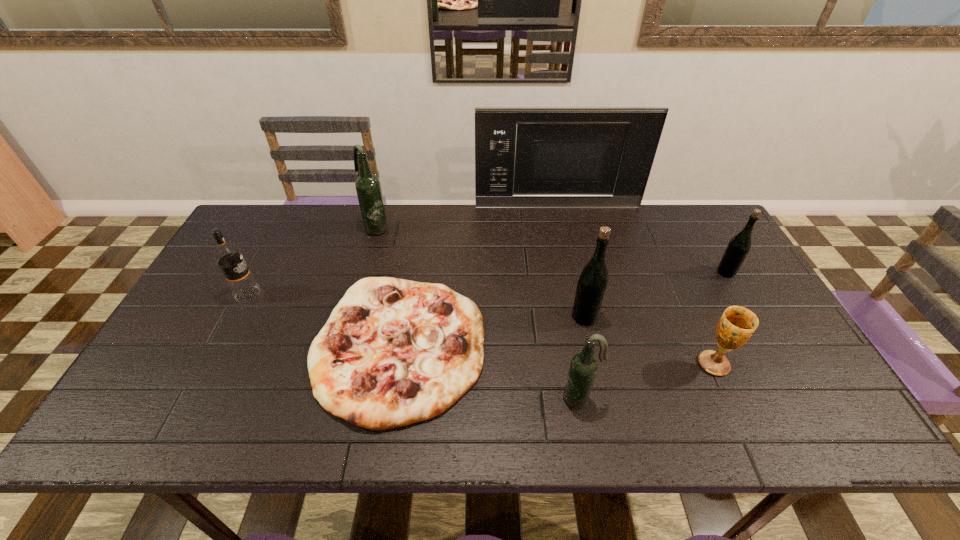
Where is `vacant space at the right edge`? This screenshot has height=540, width=960. vacant space at the right edge is located at coordinates (722, 309).

The image size is (960, 540). In the image, there is a desktop. Identify the location of vacant area at the far left corner. (276, 240).

Identify the location of vacant space at the far right corner of the desktop. (720, 237).

You are a GUI agent. You are given a task and a screenshot of the screen. Output one action in this format:
    pyautogui.click(x=<x>, y=<y>)
    Task: Click on the free space between the leftmost object and the shortest object
    The height and width of the screenshot is (540, 960).
    Given the screenshot: What is the action you would take?
    pyautogui.click(x=324, y=321)

This screenshot has height=540, width=960. In order to click on empty space between the shortest object and the nearer dark beer bottle in this screenshot , I will do `click(490, 373)`.

Find the location of a particular element. Image resolution: width=960 pixels, height=540 pixels. vacant region between the chalice and the second farthest object is located at coordinates (544, 296).

The width and height of the screenshot is (960, 540). I want to click on free point between the chalice and the right dark beer bottle, so click(x=647, y=381).

What are the coordinates of `vacant space that's between the vodka and the right green beer bottle` in the screenshot? It's located at (487, 284).

Find the location of a particular element. Image resolution: width=960 pixels, height=540 pixels. empty location between the left green beer bottle and the pizza is located at coordinates (x=492, y=332).

The width and height of the screenshot is (960, 540). In order to click on free space between the shortest object and the right green beer bottle in this screenshot , I will do [x=563, y=309].